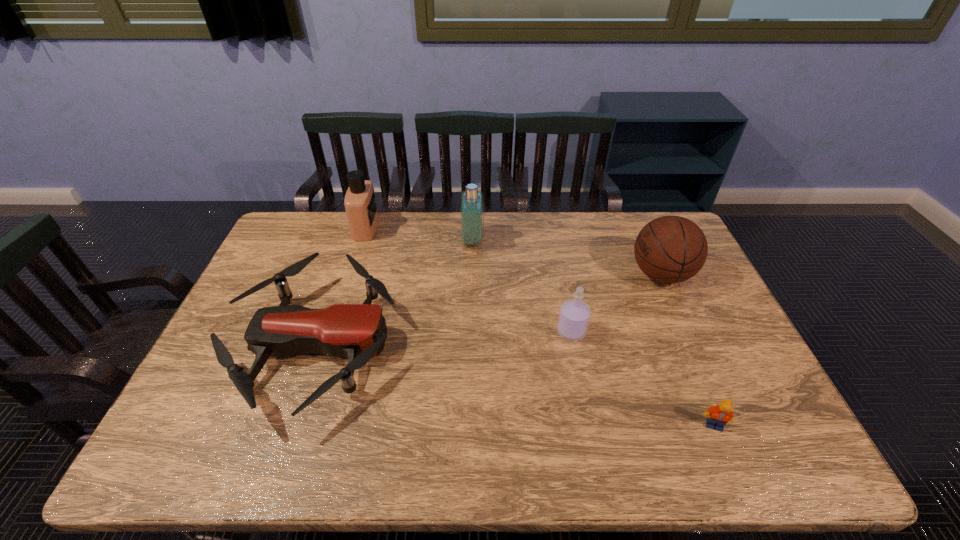
Find the location of a particular element. This screenshot has height=540, width=960. object at the near left corner is located at coordinates (357, 331).

This screenshot has width=960, height=540. I want to click on object that is at the near right corner, so click(719, 415).

The height and width of the screenshot is (540, 960). I want to click on vacant space at the far edge of the desktop, so click(x=527, y=248).

What are the coordinates of `vacant area at the near edge` in the screenshot? It's located at (458, 444).

Where is `vacant space at the left edge`? vacant space at the left edge is located at coordinates point(204,377).

This screenshot has height=540, width=960. In the image, there is a desktop. Identify the location of vacant area at the right edge. (748, 392).

Find the location of a particular element. free spot at the far left corner of the desktop is located at coordinates (289, 218).

Locate an element on the screen. This screenshot has height=540, width=960. unoccupied position between the drone and the basketball is located at coordinates (488, 309).

Find the location of a particular element. Image resolution: width=960 pixels, height=540 pixels. free space that is in between the basketball and the rightmost perfume is located at coordinates (616, 303).

Find the location of a particular element. vacant space in between the shortest perfume and the leftmost perfume is located at coordinates 468,280.